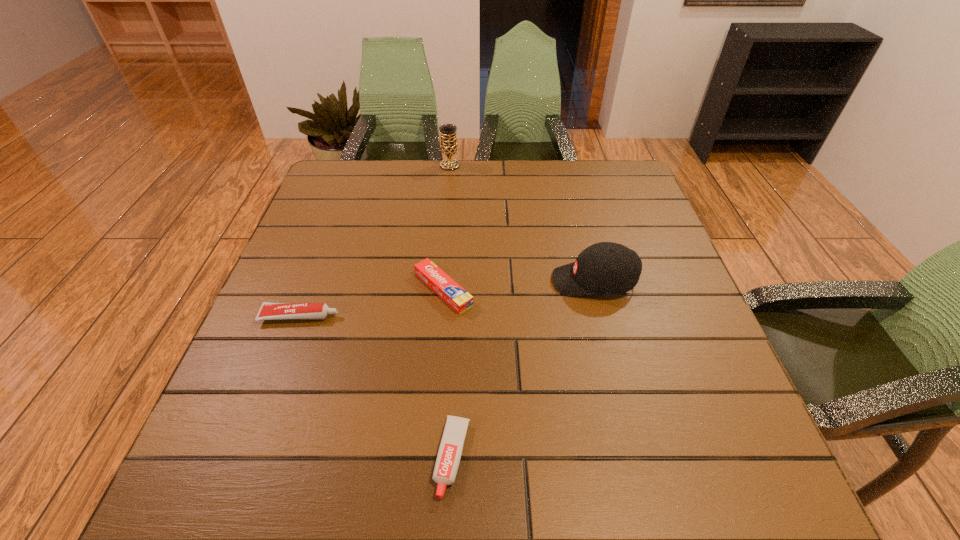
I want to click on toothpaste that stands as the second closest to the baseball cap, so click(x=451, y=446).

This screenshot has height=540, width=960. I want to click on the closest toothpaste relative to the farthest object, so click(x=452, y=293).

Identify the location of vacant space that satisfies the following two spatial constraints: 1. at the nozzle of the leftmost object; 2. on the left side of the nearest object. The height and width of the screenshot is (540, 960). (248, 457).